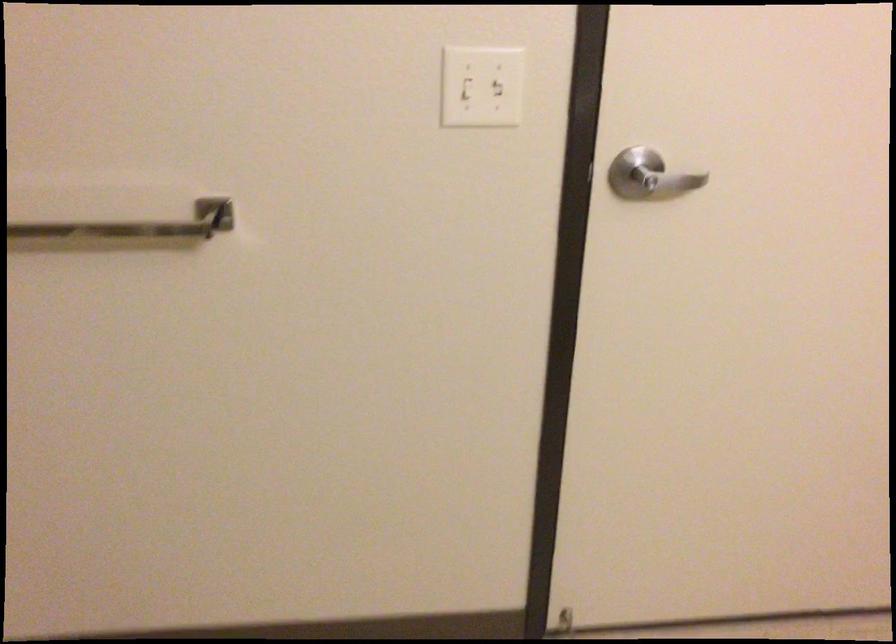
What do you see at coordinates (135, 225) in the screenshot?
I see `the silver door handle` at bounding box center [135, 225].